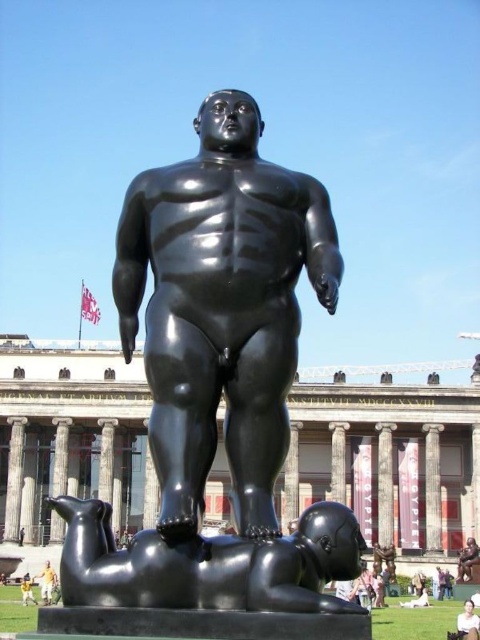
You are an art student analyzing the sculptures in the public square. You notice the glossy black dog at lower center and the smooth stone pillar at center. Which object is positioned higher in the image?

The glossy black dog at lower center is above the smooth stone pillar at center, so it is positioned higher in the image.

Based on the photo, you are an artist planning to place a new sculpture in the park. You need to ensure that the new sculpture will not block the view of the black glossy statue at center. The smooth gray stone pillar at center is already in place. Which existing sculpture should you consider when determining placement to avoid blocking the view?

The black glossy statue at center is larger than the smooth gray stone pillar at center, so you should prioritize not blocking the view of the black glossy statue at center since it is the larger and possibly more prominent artwork in the area.